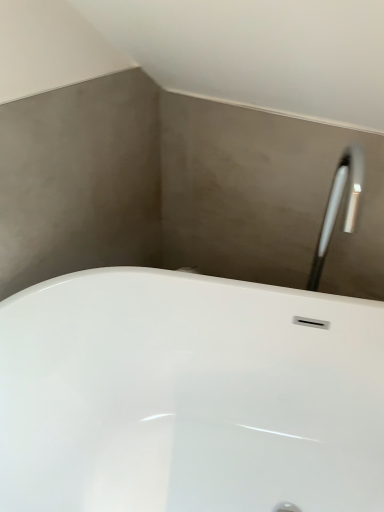
Measure the distance between point (251,332) and camera.

The depth of point (251,332) is 1.22 meters.

What do you see at coordinates (189, 396) in the screenshot?
I see `white glossy bathtub at center` at bounding box center [189, 396].

The height and width of the screenshot is (512, 384). I want to click on white glossy bathtub at center, so click(189, 396).

This screenshot has height=512, width=384. In order to click on white glossy bathtub at center in this screenshot , I will do 189,396.